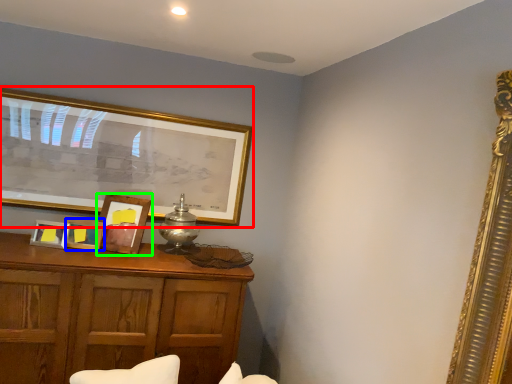
Question: Estimate the real-world distances between objects in this image. Which object is farther from picture frame (highlighted by a red box), picture frame (highlighted by a blue box) or picture frame (highlighted by a green box)?

Choices:
 (A) picture frame
 (B) picture frame

Answer: (A)